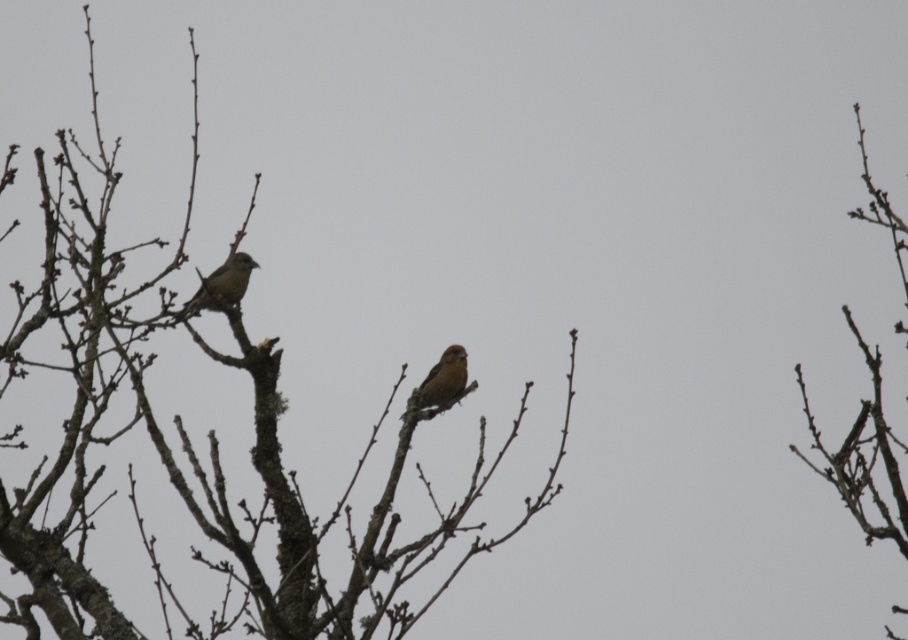
Question: Is bark textured branch at right to the right of brown matte bird at left from the viewer's perspective?

Choices:
 (A) yes
 (B) no

Answer: (A)

Question: Among these points, which one is nearest to the camera?

Choices:
 (A) coord(437,403)
 (B) coord(877,426)

Answer: (B)

Question: Which point is farther from the camera taking this photo?

Choices:
 (A) (40, 486)
 (B) (455, 392)
 (C) (882, 200)
 (D) (215, 289)

Answer: (B)

Question: Is brown textured tree at center bigger than brown matte bird at center?

Choices:
 (A) yes
 (B) no

Answer: (A)

Question: Does brown textured tree at center appear on the right side of brown matte bird at center?

Choices:
 (A) yes
 (B) no

Answer: (B)

Question: Among these objects, which one is farthest from the camera?

Choices:
 (A) brown matte bird at center
 (B) brown textured tree at center

Answer: (A)